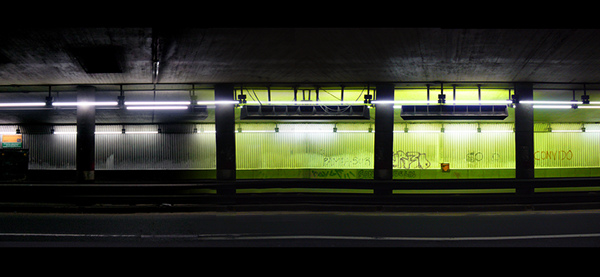
Locate an element on the screen. pillars is located at coordinates click(x=377, y=160), click(x=219, y=151), click(x=80, y=154), click(x=526, y=159).